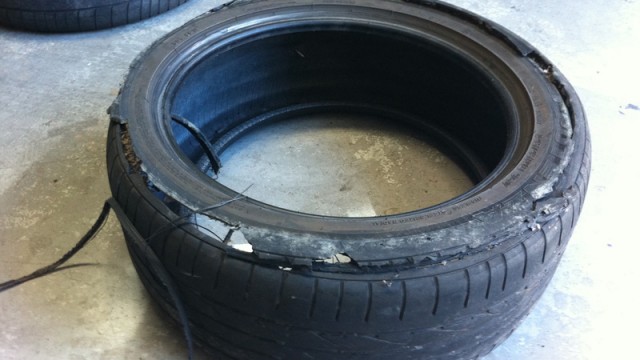
This screenshot has height=360, width=640. Identify the location of concrete floor. (31, 74).